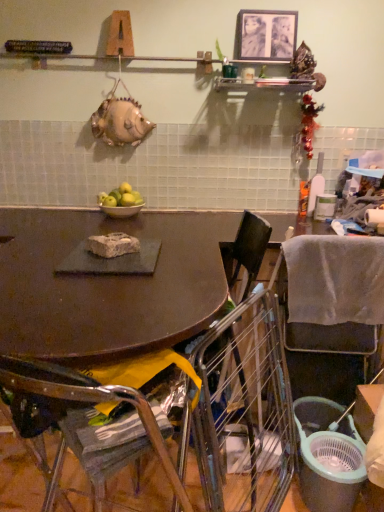
Question: Considering the positions of green matte apples at center and metallic silver shelf at upper center in the image, is green matte apples at center taller or shorter than metallic silver shelf at upper center?

Choices:
 (A) short
 (B) tall

Answer: (A)

Question: Is green matte apples at center bigger or smaller than metallic silver shelf at upper center?

Choices:
 (A) small
 (B) big

Answer: (A)

Question: Estimate the real-world distances between objects in this image. Which object is farther from the matte black table at center?

Choices:
 (A) matte black trash can at lower right
 (B) green matte apples at center
 (C) metallic wire chair at lower right, the second chair when ordered from right to left
 (D) metallic silver shelf at upper center
 (E) metallic silver picture frame at upper center

Answer: (E)

Question: Based on their relative distances, which object is nearer to the green matte apples at center?

Choices:
 (A) metallic silver picture frame at upper center
 (B) metallic wire chair at lower right, acting as the 2th chair starting from the left
 (C) matte black trash can at lower right
 (D) gray fabric chair at lower right, which is the 1th chair from right to left
 (E) metallic silver bowl at center

Answer: (E)